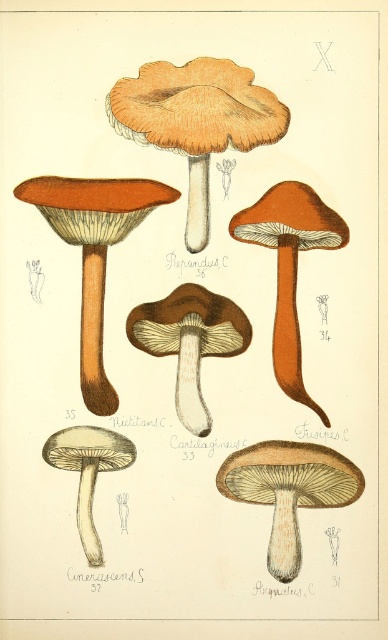
Question: Which is nearer to the smooth beige mushroom at lower left?

Choices:
 (A) matte orange cap at upper center
 (B) matte brown mushroom at center
 (C) matte orange mushroom at left
 (D) smooth beige mushroom at center

Answer: (D)

Question: Is matte orange cap at upper center bigger than matte orange mushroom at left?

Choices:
 (A) yes
 (B) no

Answer: (A)

Question: Among these points, which one is nearest to the camera?

Choices:
 (A) (270, 202)
 (B) (152, 332)

Answer: (A)

Question: Observing the image, what is the correct spatial positioning of matte orange mushroom at left in reference to smooth beige mushroom at lower left?

Choices:
 (A) below
 (B) above

Answer: (B)

Question: Does matte orange cap at upper center have a lesser width compared to matte orange mushroom at left?

Choices:
 (A) no
 (B) yes

Answer: (A)

Question: Among these points, which one is nearest to the camera?

Choices:
 (A) (81, 340)
 (B) (187, 422)
 (C) (254, 202)

Answer: (B)